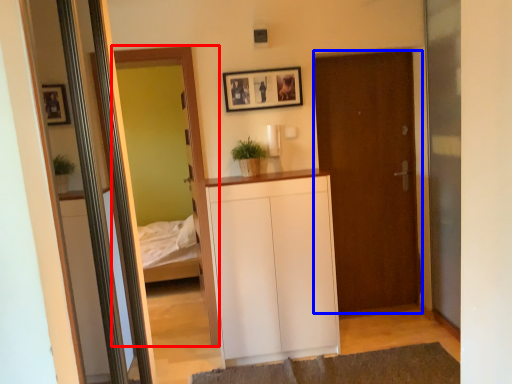
Question: Among these objects, which one is nearest to the camera, mirror (highlighted by a red box) or door (highlighted by a blue box)?

Choices:
 (A) mirror
 (B) door

Answer: (A)